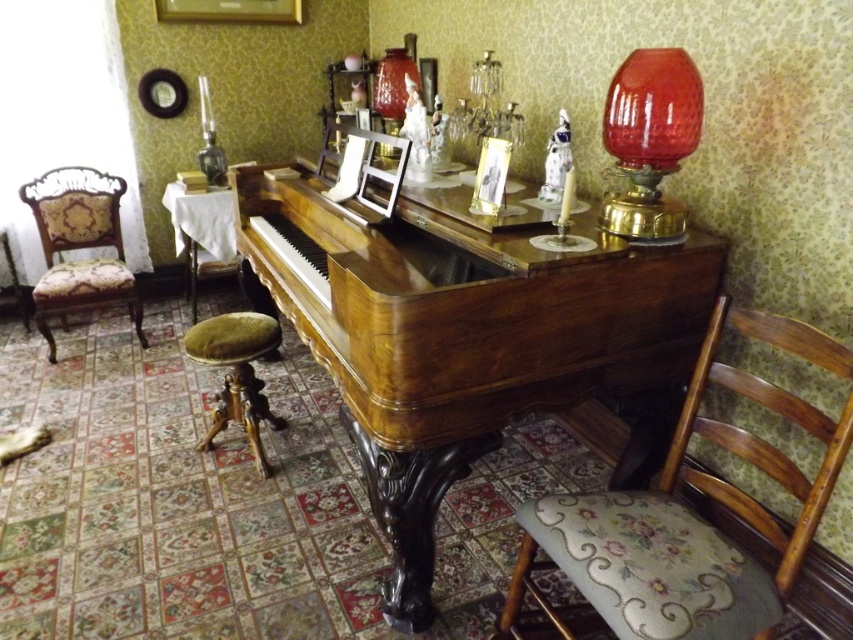
Does shiny wood piano at center have a larger size compared to red glass lampshade at upper center?

Correct, shiny wood piano at center is larger in size than red glass lampshade at upper center.

Does shiny wood piano at center appear on the right side of red glass lampshade at upper center?

Incorrect, shiny wood piano at center is not on the right side of red glass lampshade at upper center.

Based on the photo, who is more distant from viewer, [265,166] or [398,83]?

The point [265,166] is more distant.

Locate an element on the screen. This screenshot has width=853, height=640. shiny wood piano at center is located at coordinates (456, 333).

Who is shorter, shiny wood piano at center or velvet green stool at center?

With less height is velvet green stool at center.

Between point (428, 548) and point (235, 376), which one is positioned in front?

Point (428, 548) is in front.

Who is more forward, (x=494, y=308) or (x=263, y=419)?

Positioned in front is point (x=494, y=308).

At what (x,y) coordinates should I click in order to perform the action: click on shiny wood piano at center. Please return your answer as a coordinate pair (x, y). Looking at the image, I should click on (456, 333).

From the picture: Can you confirm if wooden floral-patterned chair at lower right is smaller than velvet green stool at center?

No, wooden floral-patterned chair at lower right is not smaller than velvet green stool at center.

Who is more forward, (602,532) or (268,320)?

Point (602,532)

Where is `wooden floral-patterned chair at lower right`? Image resolution: width=853 pixels, height=640 pixels. wooden floral-patterned chair at lower right is located at coordinates (688, 516).